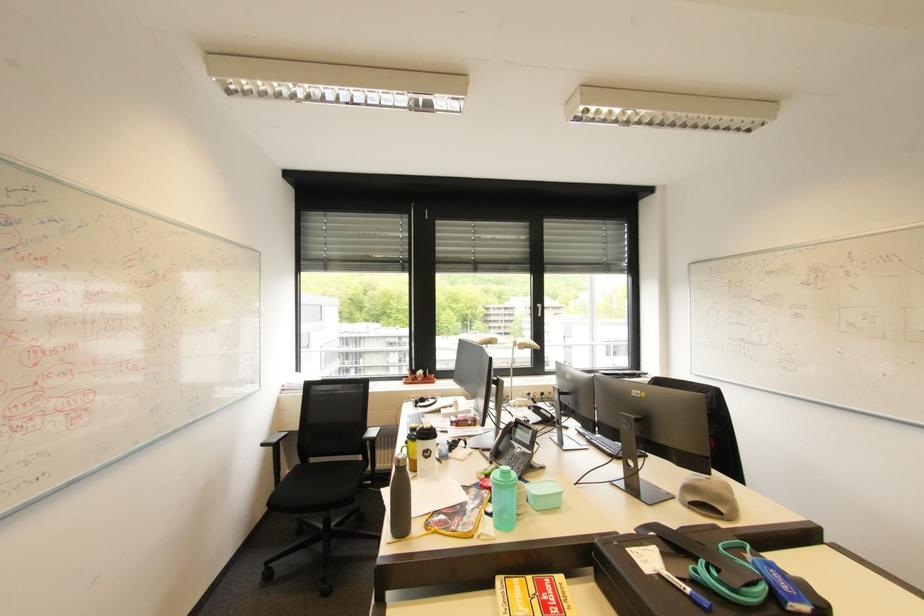
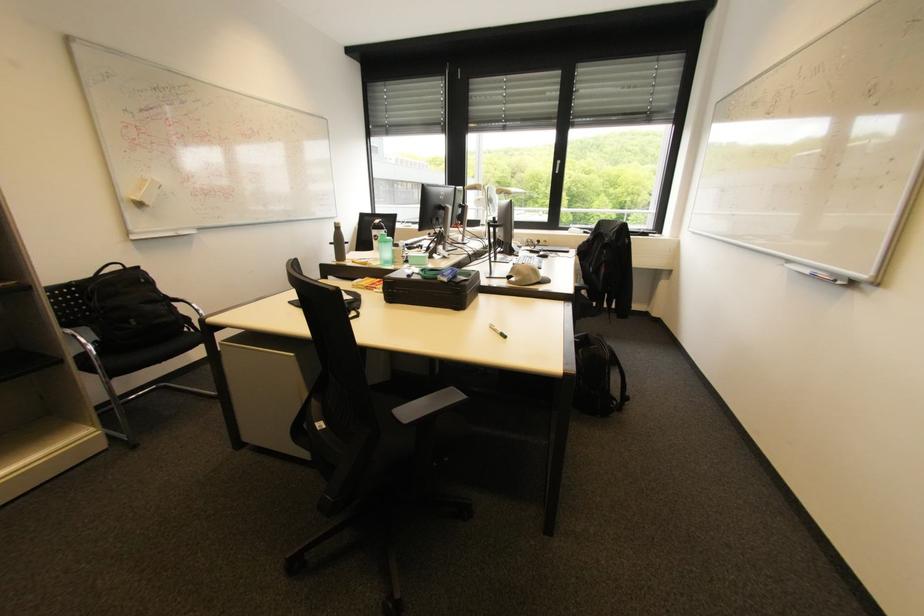
Find the pixel in the second image that matches (x=268, y=446) in the first image.

(335, 244)